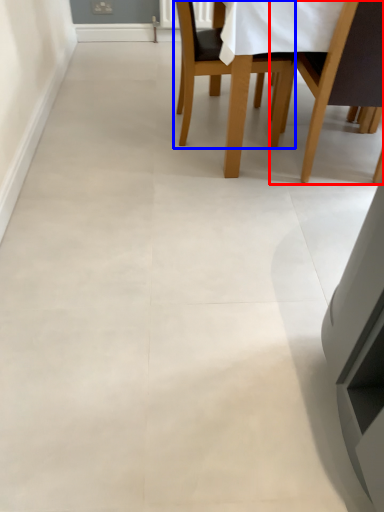
Question: Which point is further to the camera, chair (highlighted by a red box) or chair (highlighted by a blue box)?

Choices:
 (A) chair
 (B) chair

Answer: (B)